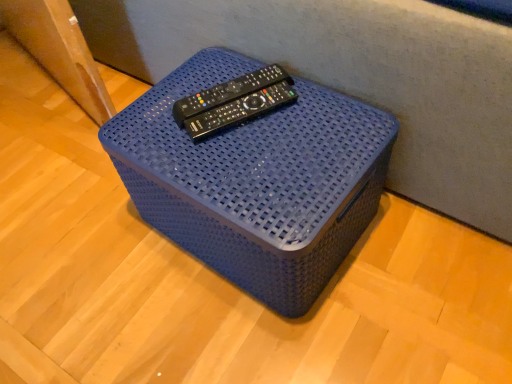
Question: From a real-world perspective, is blue woven basket at center physically below black plastic remote at center?

Choices:
 (A) yes
 (B) no

Answer: (A)

Question: Can you confirm if blue woven basket at center is shorter than black plastic remote at center?

Choices:
 (A) yes
 (B) no

Answer: (B)

Question: From a real-world perspective, is blue woven basket at center on black plastic remote at center?

Choices:
 (A) no
 (B) yes

Answer: (A)

Question: Does blue woven basket at center contain black plastic remote at center?

Choices:
 (A) yes
 (B) no

Answer: (B)

Question: Is blue woven basket at center positioned with its back to black plastic remote at center?

Choices:
 (A) no
 (B) yes

Answer: (A)

Question: Does blue woven basket at center have a greater height compared to black plastic remote at center?

Choices:
 (A) yes
 (B) no

Answer: (A)

Question: From the image's perspective, would you say black plastic remote at center is shown under blue woven basket at center?

Choices:
 (A) no
 (B) yes

Answer: (A)

Question: Is black plastic remote at center facing away from blue woven basket at center?

Choices:
 (A) yes
 (B) no

Answer: (B)

Question: Does black plastic remote at center have a lesser width compared to blue woven basket at center?

Choices:
 (A) yes
 (B) no

Answer: (A)

Question: Does black plastic remote at center have a lesser height compared to blue woven basket at center?

Choices:
 (A) yes
 (B) no

Answer: (A)

Question: Does black plastic remote at center contain blue woven basket at center?

Choices:
 (A) no
 (B) yes

Answer: (A)

Question: Considering the relative sizes of black plastic remote at center and blue woven basket at center in the image provided, is black plastic remote at center bigger than blue woven basket at center?

Choices:
 (A) no
 (B) yes

Answer: (A)

Question: Looking at the image, does blue woven basket at center seem bigger or smaller compared to black plastic remote at center?

Choices:
 (A) big
 (B) small

Answer: (A)